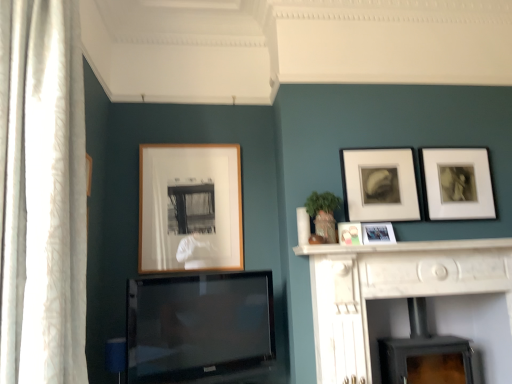
Question: From the image's perspective, is metallic silver photo frame at center-right, which appears as the third picture frame when viewed from the right, over white marble fireplace at center?

Choices:
 (A) yes
 (B) no

Answer: (A)

Question: Is metallic silver photo frame at center-right, positioned as the 3th picture frame in left-to-right order, aimed at white marble fireplace at center?

Choices:
 (A) no
 (B) yes

Answer: (A)

Question: Is metallic silver photo frame at center-right, which appears as the third picture frame when viewed from the right, oriented away from white marble fireplace at center?

Choices:
 (A) yes
 (B) no

Answer: (B)

Question: Does metallic silver photo frame at center-right, which appears as the third picture frame when viewed from the right, appear on the right side of white marble fireplace at center?

Choices:
 (A) yes
 (B) no

Answer: (B)

Question: Can you confirm if metallic silver photo frame at center-right, which appears as the third picture frame when viewed from the right, is bigger than white marble fireplace at center?

Choices:
 (A) yes
 (B) no

Answer: (B)

Question: Considering the relative sizes of metallic silver photo frame at center-right, which appears as the third picture frame when viewed from the right, and white marble fireplace at center in the image provided, is metallic silver photo frame at center-right, which appears as the third picture frame when viewed from the right, wider than white marble fireplace at center?

Choices:
 (A) yes
 (B) no

Answer: (B)

Question: Could you tell me if wooden frame at center, which appears as the first picture frame when viewed from the left, is facing flat-screen tv at center?

Choices:
 (A) yes
 (B) no

Answer: (B)

Question: Can you confirm if wooden frame at center, which appears as the first picture frame when viewed from the left, is smaller than flat-screen tv at center?

Choices:
 (A) no
 (B) yes

Answer: (B)

Question: Would you consider wooden frame at center, which appears as the first picture frame when viewed from the left, to be distant from flat-screen tv at center?

Choices:
 (A) no
 (B) yes

Answer: (A)

Question: Is wooden frame at center, positioned as the fifth picture frame in right-to-left order, positioned behind flat-screen tv at center?

Choices:
 (A) no
 (B) yes

Answer: (B)

Question: Considering the relative sizes of wooden frame at center, which appears as the first picture frame when viewed from the left, and flat-screen tv at center in the image provided, is wooden frame at center, which appears as the first picture frame when viewed from the left, taller than flat-screen tv at center?

Choices:
 (A) no
 (B) yes

Answer: (B)

Question: From the image's perspective, does wooden frame at center, positioned as the fifth picture frame in right-to-left order, appear lower than flat-screen tv at center?

Choices:
 (A) no
 (B) yes

Answer: (A)

Question: Does flat-screen tv at center have a greater height compared to black matte wood burning stove at lower center?

Choices:
 (A) no
 (B) yes

Answer: (B)